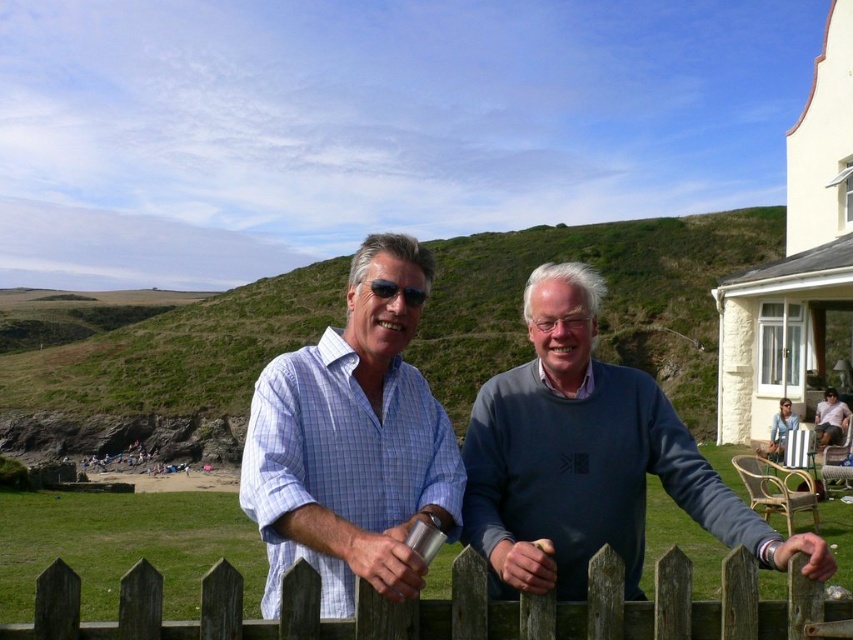
Question: Can you confirm if light brown wooden chair at lower right is positioned to the right of denim jacket at lower right?

Choices:
 (A) yes
 (B) no

Answer: (A)

Question: Is dark gray sweater at center positioned behind light brown wooden chair at lower right?

Choices:
 (A) no
 (B) yes

Answer: (A)

Question: Which object is the farthest from the blue checkered shirt at center?

Choices:
 (A) dark gray sweater at center
 (B) wooden fence at center
 (C) denim jacket at lower right

Answer: (C)

Question: Based on their relative distances, which object is nearer to the light brown wooden chair at lower right?

Choices:
 (A) wooden fence at center
 (B) dark gray sweater at center

Answer: (B)

Question: Can you confirm if dark gray sweater at center is positioned below wooden fence at center?

Choices:
 (A) no
 (B) yes

Answer: (A)

Question: Based on their relative distances, which object is farther from the light brown wooden chair at lower right?

Choices:
 (A) wooden fence at center
 (B) dark gray sweater at center

Answer: (A)